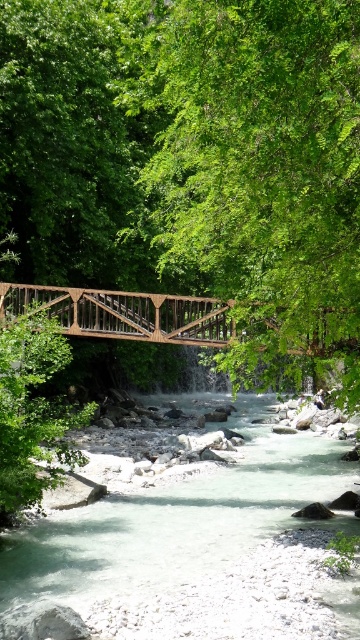
Question: Does green leafy tree at center have a smaller size compared to wooden bridge at center?

Choices:
 (A) no
 (B) yes

Answer: (A)

Question: Which point is farther from the camera taking this photo?

Choices:
 (A) (353, 241)
 (B) (209, 340)
 (C) (102, 582)

Answer: (B)

Question: Which point is farther to the camera?

Choices:
 (A) (164, 29)
 (B) (119, 333)
 (C) (118, 497)

Answer: (C)

Question: Which point is farther to the camera?

Choices:
 (A) (140, 570)
 (B) (236, 298)
 (C) (186, 328)

Answer: (C)

Question: Considering the relative positions of green leafy tree at center and wooden bridge at center in the image provided, where is green leafy tree at center located with respect to wooden bridge at center?

Choices:
 (A) above
 (B) below

Answer: (A)

Question: Considering the relative positions of white smooth river at center and wooden bridge at center in the image provided, where is white smooth river at center located with respect to wooden bridge at center?

Choices:
 (A) below
 (B) above

Answer: (A)